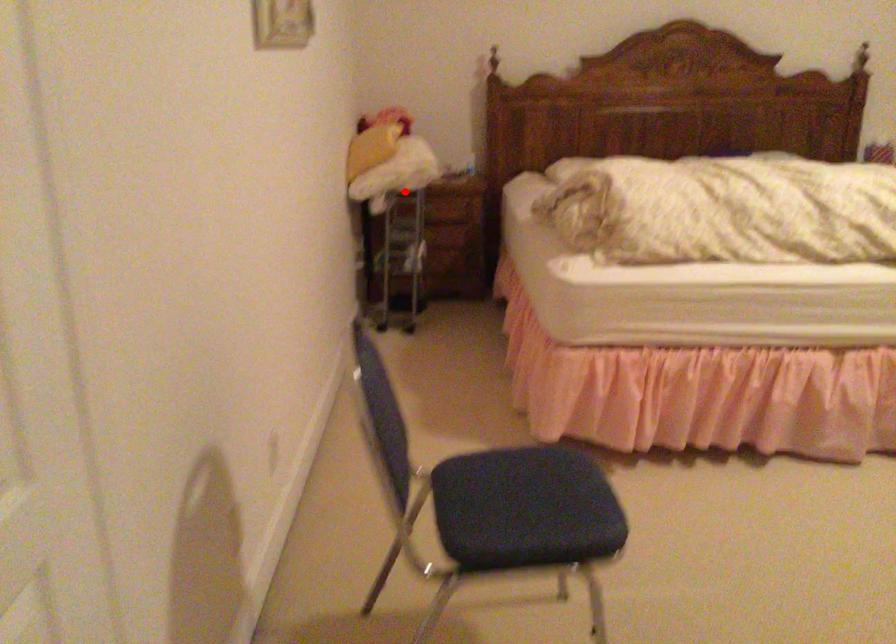
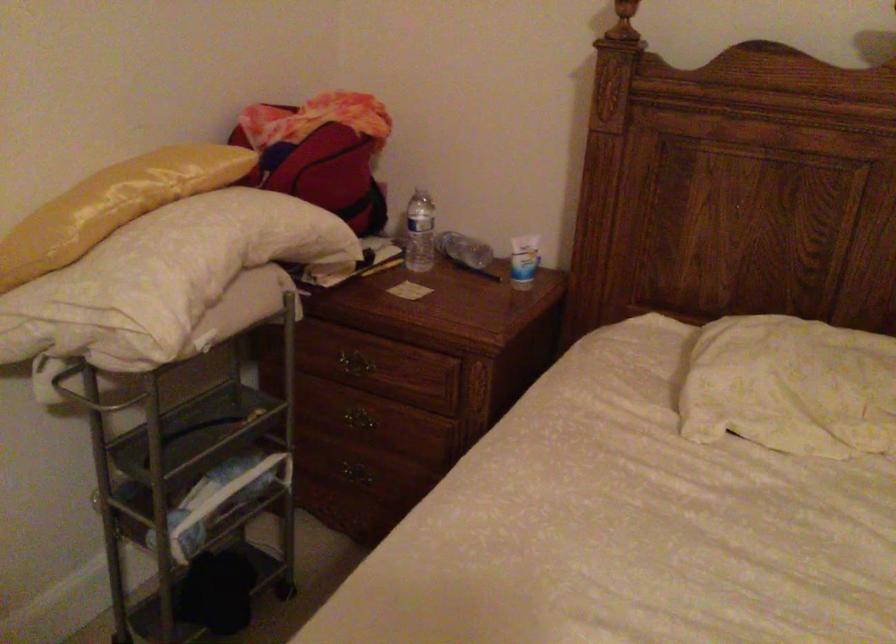
Locate, in the second image, the point that corresponds to the highlighted location in the first image.

(91, 393)